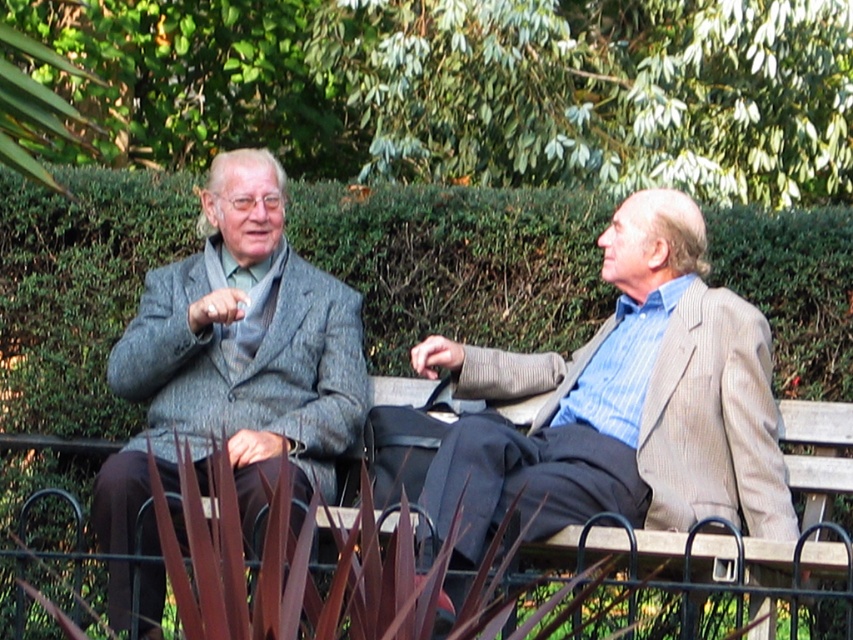
Who is more distant from viewer, [608,353] or [329,289]?

The point [329,289] is behind.

Is point (772, 413) closer to camera compared to point (296, 381)?

Yes, it is in front of point (296, 381).

Locate an element on the screen. gray woolen suit at center is located at coordinates (624, 403).

Is light brown textured suit at right smaller than wooden bench at center?

No, light brown textured suit at right is not smaller than wooden bench at center.

Who is taller, light brown textured suit at right or wooden bench at center?

Standing taller between the two is light brown textured suit at right.

Between point (659, 189) and point (828, 449), which one is positioned in front?

Point (659, 189) is in front.

In order to click on light brown textured suit at right in this screenshot , I will do `click(624, 403)`.

Is point (97, 506) closer to viewer compared to point (805, 499)?

Yes, it is in front of point (805, 499).

Is gray woolen suit at center above wooden bench at center?

Indeed, gray woolen suit at center is positioned over wooden bench at center.

Find the location of a particular element. The height and width of the screenshot is (640, 853). gray woolen suit at center is located at coordinates (624, 403).

Image resolution: width=853 pixels, height=640 pixels. In order to click on gray woolen suit at center in this screenshot , I will do `click(624, 403)`.